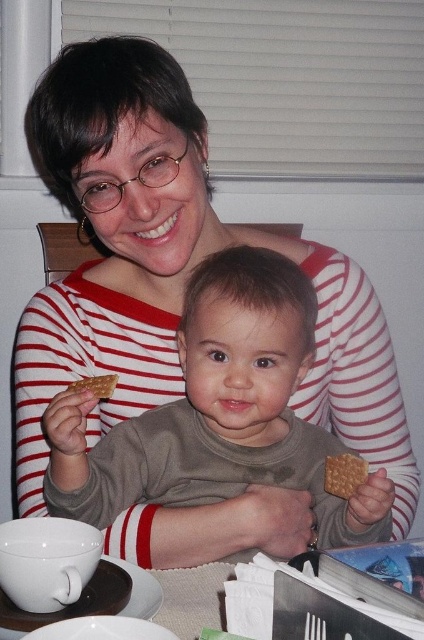
You are a robot trying to pick up the crusty golden cracker at center without touching the matte gray shirt at center. Given that the robot has a 6.5 inch long arm, will it be able to reach the cracker?

The distance between the matte gray shirt at center and the crusty golden cracker at center is 6.81 inches. Since the robot arm is only 6.5 inches long, it cannot reach the cracker without touching the shirt.

You are a photographer trying to capture the child and the cracker in the image. Since the matte gray shirt at center and the crusty golden cracker at center are both at the center, how can you ensure the cracker is visible in the photo?

The matte gray shirt at center is positioned under the crusty golden cracker at center, so you can adjust the focus to highlight the cracker above the shirt.

Consider the image. You are a child trying to choose between the matte brown cracker at lower right and the crusty golden cracker at center. Which one is wider?

The crusty golden cracker at center is wider than the matte brown cracker at lower right.